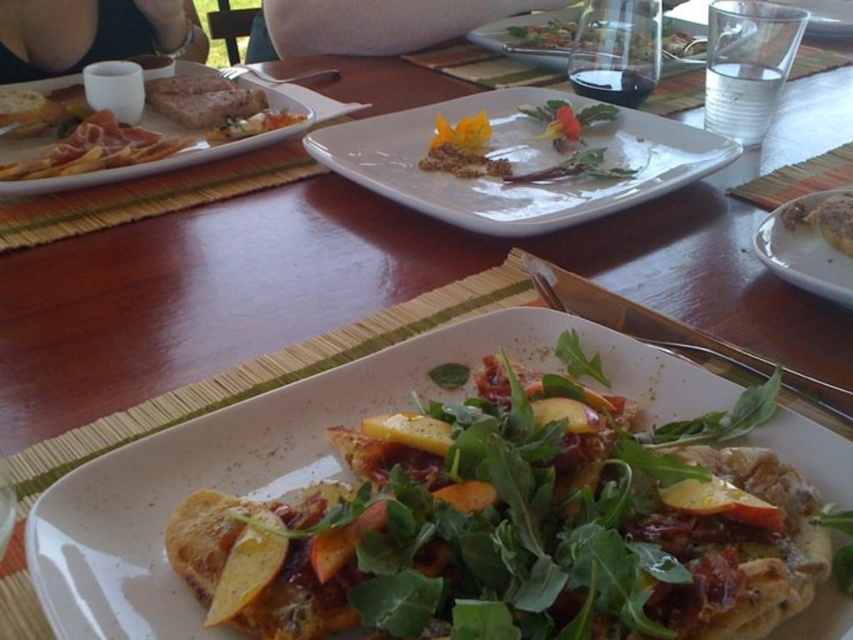
Does point (675, 173) come in front of point (21, 112)?

Yes, point (675, 173) is closer to viewer.

This screenshot has width=853, height=640. Describe the element at coordinates (518, 161) in the screenshot. I see `white glossy plate at center` at that location.

Is point (505, 232) closer to viewer compared to point (3, 97)?

Yes, it is in front of point (3, 97).

I want to click on white glossy plate at center, so click(x=518, y=161).

Does matte brown bread at left come in front of matte brown pizza at center?

Yes, matte brown bread at left is closer to the viewer.

Can you confirm if matte brown bread at left is positioned to the left of matte brown pizza at center?

Correct, you'll find matte brown bread at left to the left of matte brown pizza at center.

Identify the location of matte brown bread at left. (96, 148).

Does point (463, 163) lie behind point (844, 189)?

Yes, it is.

From the picture: Which is above, matte brown crumb at center or white ceramic plate at lower right?

matte brown crumb at center is above.

This screenshot has height=640, width=853. What do you see at coordinates (521, 145) in the screenshot?
I see `matte brown crumb at center` at bounding box center [521, 145].

Where is `matte brown crumb at center`? The image size is (853, 640). matte brown crumb at center is located at coordinates (521, 145).